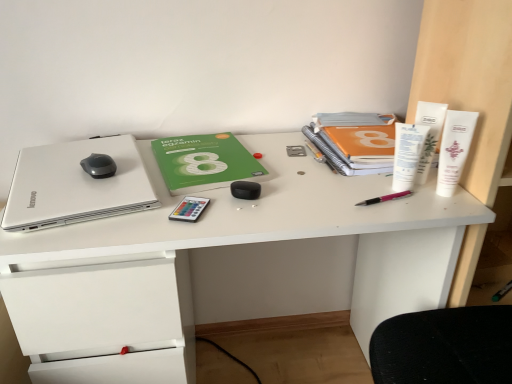
The width and height of the screenshot is (512, 384). What are the coordinates of `free area in between green matte paperback book at center, which appears as the 1th paperback book when viewed from the left, and white plastic tube at upper right, which is the fifth stationery in left-to-right order` in the screenshot? It's located at (303, 173).